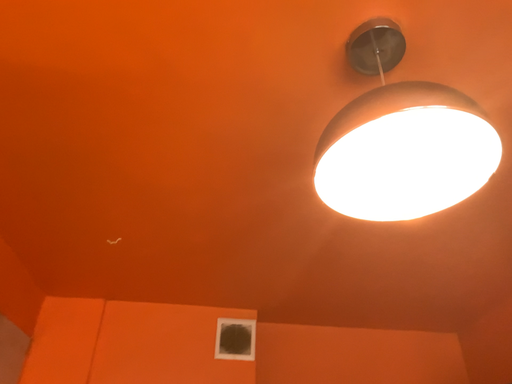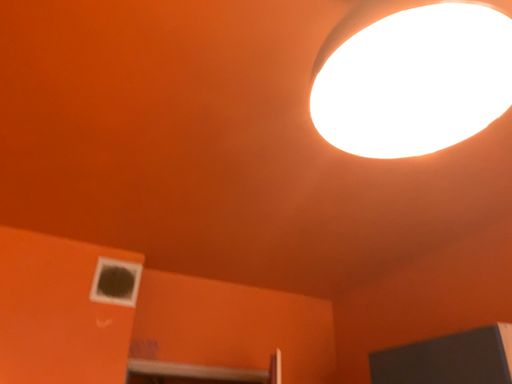
Question: Which way did the camera rotate in the video?

Choices:
 (A) rotated downward
 (B) rotated upward

Answer: (A)